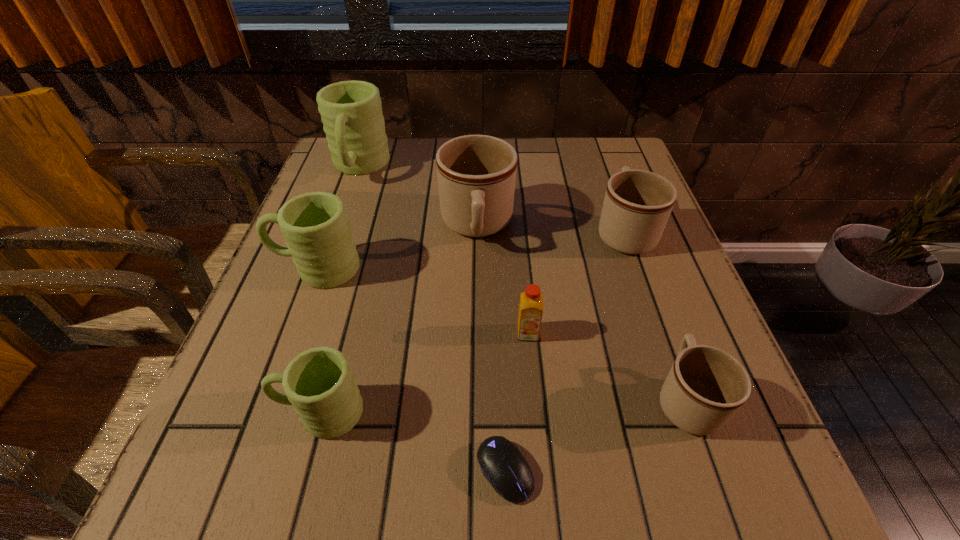
Where is `the farthest green mug`? the farthest green mug is located at coordinates (351, 111).

This screenshot has height=540, width=960. What are the coordinates of `the biggest green mug` in the screenshot? It's located at (351, 111).

Image resolution: width=960 pixels, height=540 pixels. I want to click on the leftmost brown mug, so click(476, 174).

The image size is (960, 540). In order to click on the biggest brown mug in this screenshot , I will do `click(476, 174)`.

Identify the location of the second smallest green mug. (315, 225).

Locate an element on the screen. The width and height of the screenshot is (960, 540). the second biggest brown mug is located at coordinates (637, 205).

Image resolution: width=960 pixels, height=540 pixels. I want to click on the fourth nearest object, so click(531, 301).

Locate an element on the screen. The image size is (960, 540). the nearest green mug is located at coordinates (319, 384).

Where is `the smallest brown mug`? The image size is (960, 540). the smallest brown mug is located at coordinates (706, 386).

This screenshot has width=960, height=540. What are the coordinates of `the shortest object` in the screenshot? It's located at (502, 463).